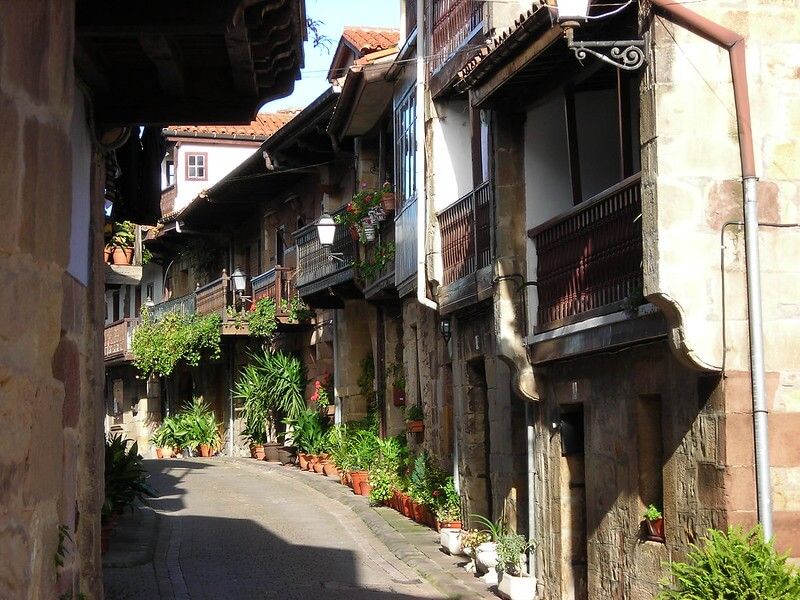
Image resolution: width=800 pixels, height=600 pixels. In order to click on black metal trim in this screenshot , I will do `click(608, 52)`.